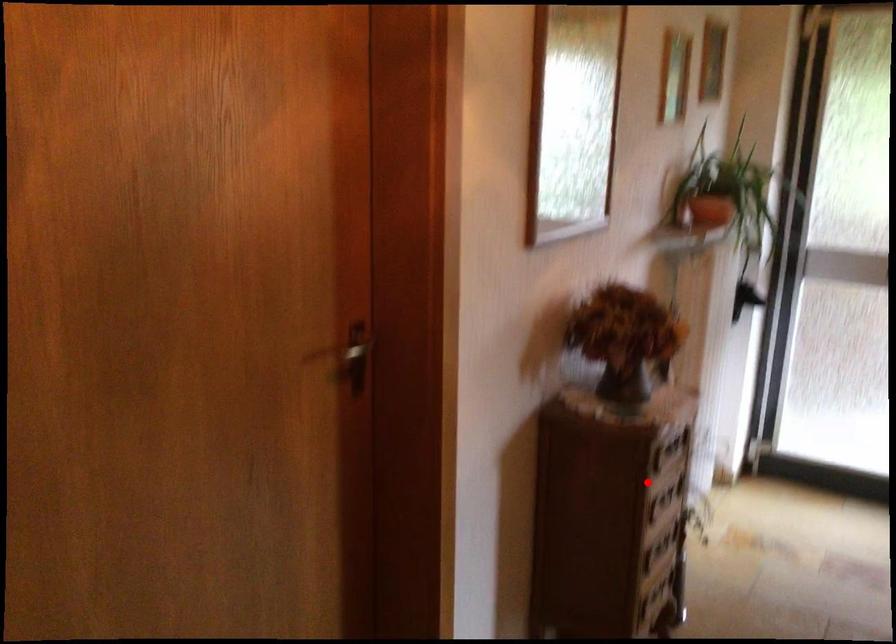
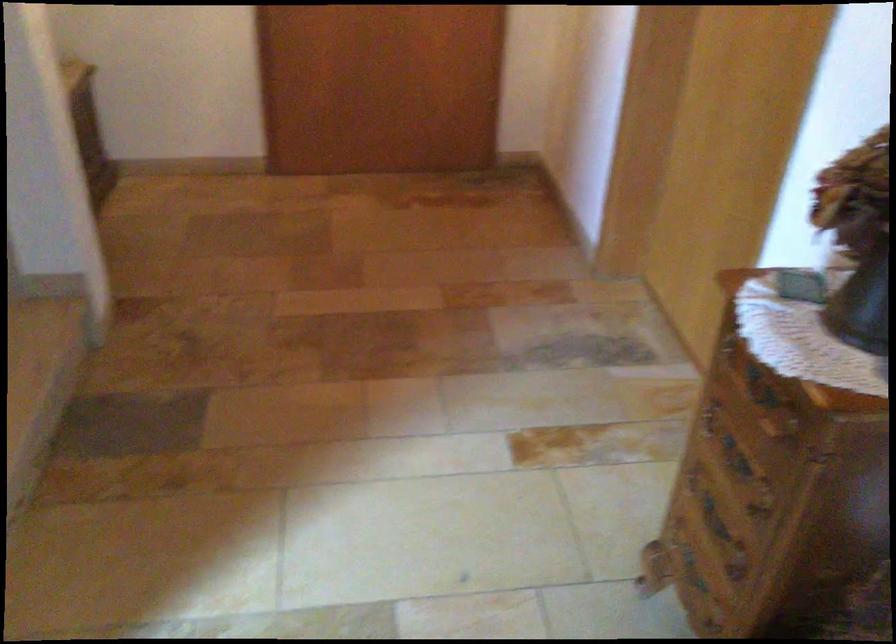
Find the pixel in the second image that matches the highlighted location in the first image.

(760, 386)